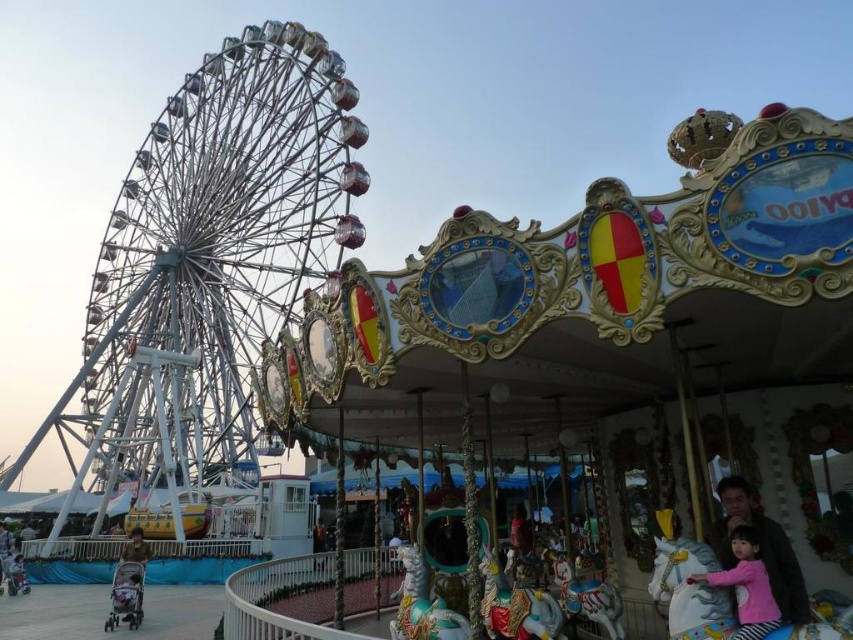
Is white metallic ferris wheel at left positioned in front of pink fabric at center?

No, it is not.

Is white metallic ferris wheel at left taller than pink fabric at center?

Yes, white metallic ferris wheel at left is taller than pink fabric at center.

Locate an element on the screen. This screenshot has width=853, height=640. white metallic ferris wheel at left is located at coordinates (216, 257).

Who is more forward, (x=802, y=608) or (x=735, y=630)?

Point (x=735, y=630) is in front.

Which is behind, point (772, 557) or point (770, 598)?

The point (772, 557) is more distant.

Does point (729, 554) come behind point (689, 576)?

That is True.

Image resolution: width=853 pixels, height=640 pixels. In order to click on pink fabric at center in this screenshot , I will do `click(761, 547)`.

Is point (187, 163) positioned before point (747, 552)?

No, (187, 163) is further to viewer.

Is white metallic ferris wheel at left to the right of matte pink dress at center from the viewer's perspective?

No, white metallic ferris wheel at left is not to the right of matte pink dress at center.

Find the location of a particular element. white metallic ferris wheel at left is located at coordinates (216, 257).